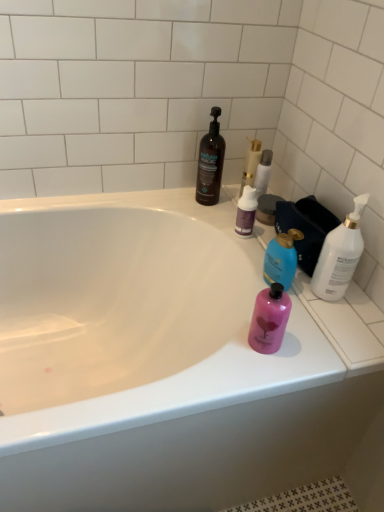
This screenshot has height=512, width=384. Find the location of `vacant area that is in front of silver metallic tube at upper center`. vacant area that is in front of silver metallic tube at upper center is located at coordinates (254, 226).